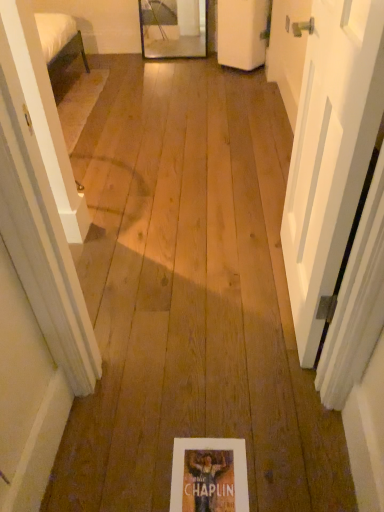
Locate an element on the screen. This screenshot has height=512, width=384. vacant space situated on the left part of white matte door at right, acting as the second door starting from the back is located at coordinates (191, 301).